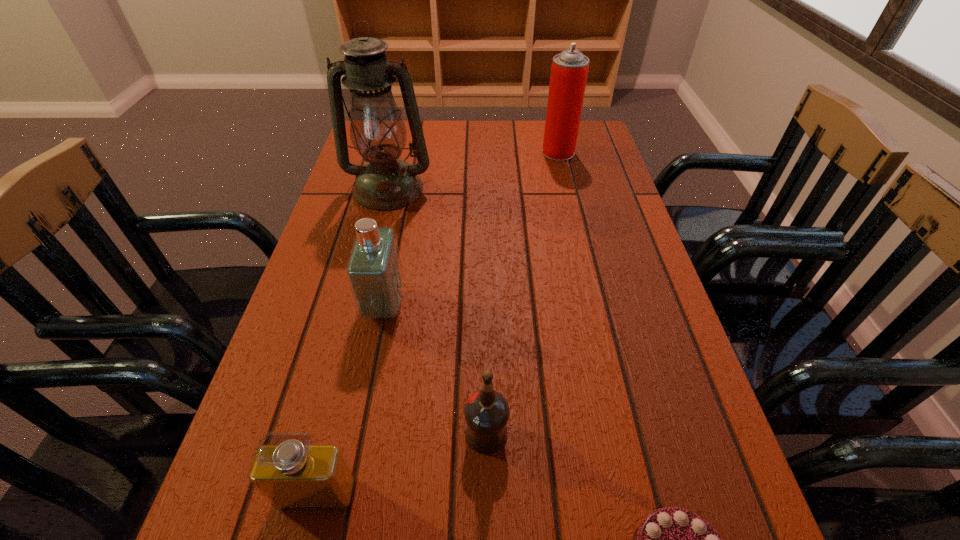
Find the location of a particular element. free region located 0.050m on the right of the tallest object is located at coordinates (450, 190).

Identify the location of vacant area located on the front of the farthest object. (570, 202).

Find the location of a particular element. free space located on the front label of the farther perfume is located at coordinates (452, 306).

Find the location of `free space located 0.330m on the front label of the third nearest object`. free space located 0.330m on the front label of the third nearest object is located at coordinates (262, 433).

I want to click on free space located on the front label of the third nearest object, so click(403, 433).

The image size is (960, 540). In order to click on vacant space located on the front label of the third nearest object in this screenshot , I will do `click(367, 433)`.

Identify the location of object present at the far edge. The height and width of the screenshot is (540, 960). (569, 70).

You are a GUI agent. You are given a task and a screenshot of the screen. Output one action in this format:
    pyautogui.click(x=<x>, y=<y>)
    Task: Click on the oil lamp present at the left edge
    The image size is (960, 540).
    Given the screenshot: What is the action you would take?
    pyautogui.click(x=378, y=133)

Identify the location of object present at the right edge. The image size is (960, 540). (569, 70).

The height and width of the screenshot is (540, 960). I want to click on object that is at the far right corner, so click(x=569, y=70).